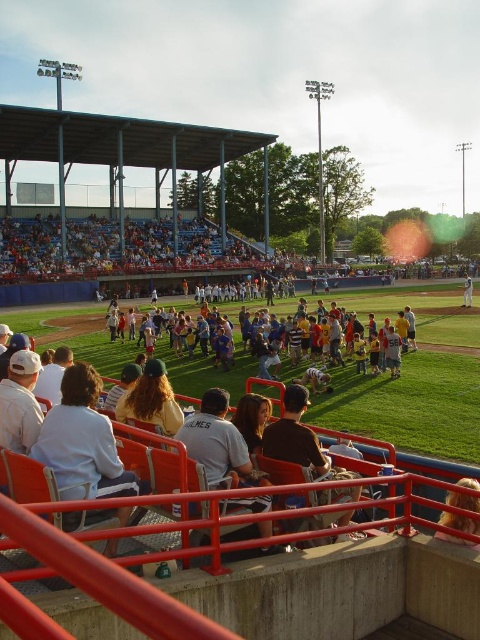
Question: Can you confirm if light blue shirt at lower left is bigger than light brown leather jacket at center?

Choices:
 (A) yes
 (B) no

Answer: (A)

Question: Among these objects, which one is farthest from the camera?

Choices:
 (A) light blue shirt at lower left
 (B) light brown leather jacket at center
 (C) white jersey at center

Answer: (C)

Question: Which object appears closest to the camera in this image?

Choices:
 (A) light blue shirt at lower left
 (B) light brown leather jacket at lower right

Answer: (B)

Question: Is light blue shirt at lower left further to camera compared to light brown leather jacket at lower right?

Choices:
 (A) yes
 (B) no

Answer: (A)

Question: Which object appears farthest from the camera in this image?

Choices:
 (A) white jersey at center
 (B) light blue shirt at lower left
 (C) light brown leather jacket at center
 (D) light brown leather jacket at lower right

Answer: (A)

Question: In this image, where is light brown leather jacket at center located relative to white jersey at center?

Choices:
 (A) left
 (B) right

Answer: (A)